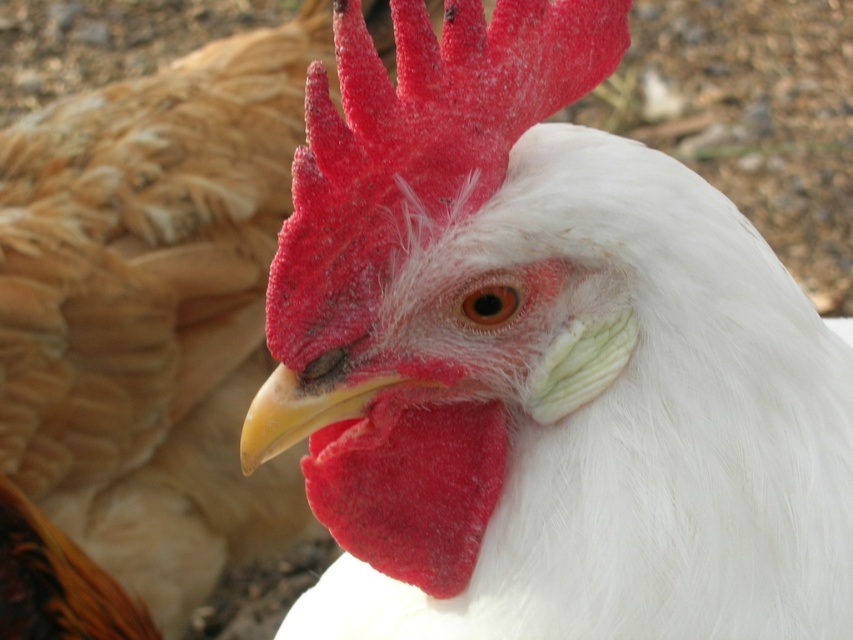
Question: Which of the following is the farthest from the observer?

Choices:
 (A) yellow beak at center
 (B) white feathered rooster at center

Answer: (A)

Question: Which point is closer to the camera?

Choices:
 (A) white feathered rooster at center
 (B) yellow beak at center

Answer: (A)

Question: Can you confirm if white feathered rooster at center is positioned below yellow beak at center?

Choices:
 (A) yes
 (B) no

Answer: (A)

Question: Does white feathered rooster at center have a greater width compared to yellow beak at center?

Choices:
 (A) no
 (B) yes

Answer: (B)

Question: Is white feathered rooster at center thinner than yellow beak at center?

Choices:
 (A) no
 (B) yes

Answer: (A)

Question: Which of the following is the closest to the observer?

Choices:
 (A) white feathered rooster at center
 (B) yellow beak at center

Answer: (A)